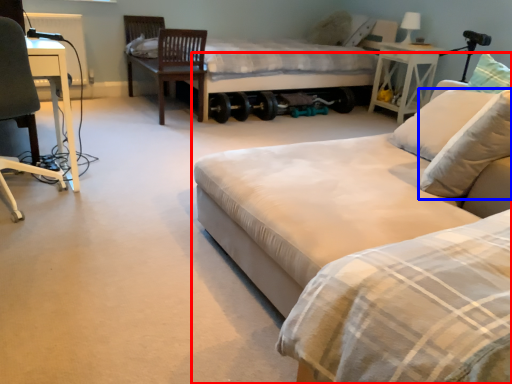
Question: Among these objects, which one is nearest to the camera, bed (highlighted by a red box) or pillow (highlighted by a blue box)?

Choices:
 (A) bed
 (B) pillow

Answer: (A)